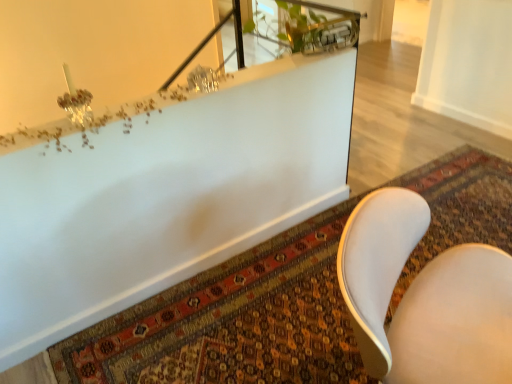
Question: Can you confirm if white leather chair at lower right is bigger than carpeted mat at lower center?

Choices:
 (A) no
 (B) yes

Answer: (B)

Question: From the image's perspective, does white leather chair at lower right appear lower than carpeted mat at lower center?

Choices:
 (A) no
 (B) yes

Answer: (B)

Question: Is white leather chair at lower right smaller than carpeted mat at lower center?

Choices:
 (A) no
 (B) yes

Answer: (A)

Question: Would you say carpeted mat at lower center is part of white leather chair at lower right's contents?

Choices:
 (A) yes
 (B) no

Answer: (B)

Question: Can you confirm if white leather chair at lower right is thinner than carpeted mat at lower center?

Choices:
 (A) yes
 (B) no

Answer: (A)

Question: Does point (250, 354) appear closer or farther from the camera than point (369, 203)?

Choices:
 (A) closer
 (B) farther

Answer: (B)

Question: Do you think carpeted mat at lower center is within white leather chair at lower right, or outside of it?

Choices:
 (A) inside
 (B) outside

Answer: (B)

Question: Based on their positions, is carpeted mat at lower center located to the left or right of white leather chair at lower right?

Choices:
 (A) left
 (B) right

Answer: (B)

Question: In terms of width, does carpeted mat at lower center look wider or thinner when compared to white leather chair at lower right?

Choices:
 (A) thin
 (B) wide

Answer: (B)

Question: Considering their positions, is white leather chair at lower right located in front of or behind carpeted mat at lower center?

Choices:
 (A) behind
 (B) front

Answer: (B)

Question: Looking at their shapes, would you say white leather chair at lower right is wider or thinner than carpeted mat at lower center?

Choices:
 (A) wide
 (B) thin

Answer: (B)

Question: From a real-world perspective, is white leather chair at lower right above or below carpeted mat at lower center?

Choices:
 (A) below
 (B) above

Answer: (B)

Question: Is white leather chair at lower right taller or shorter than carpeted mat at lower center?

Choices:
 (A) short
 (B) tall

Answer: (B)

Question: From a real-world perspective, is carpeted mat at lower center above or below white glossy bathtub at upper center?

Choices:
 (A) below
 (B) above

Answer: (B)

Question: Choose the correct answer: Is carpeted mat at lower center inside white glossy bathtub at upper center or outside it?

Choices:
 (A) inside
 (B) outside

Answer: (A)